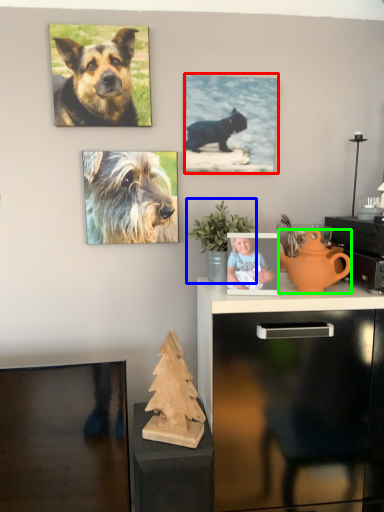
Question: Estimate the real-world distances between objects in this image. Which object is closer to picture frame (highlighted by a red box), houseplant (highlighted by a blue box) or teapot (highlighted by a green box)?

Choices:
 (A) houseplant
 (B) teapot

Answer: (A)